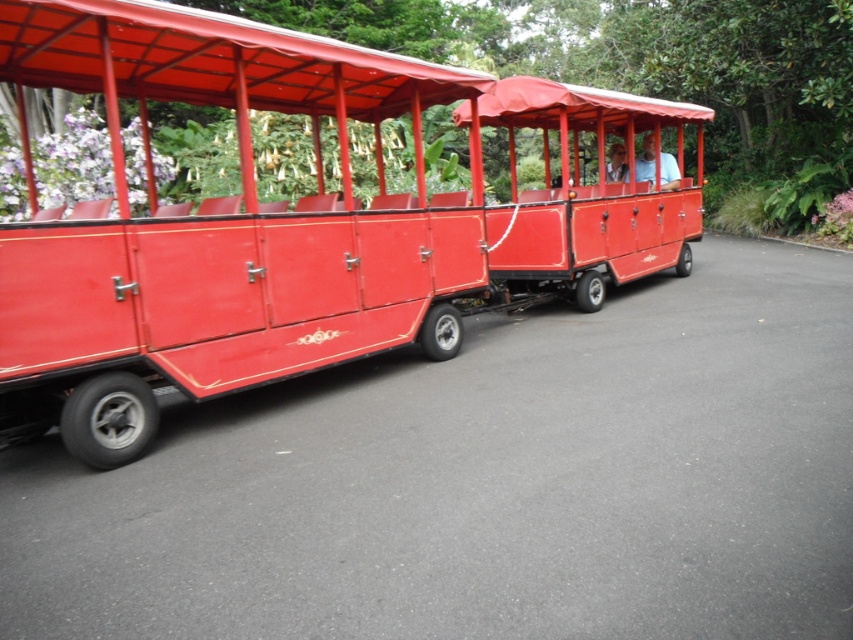
Is matte red train car at center to the right of matte red coach at center from the viewer's perspective?

No, matte red train car at center is not to the right of matte red coach at center.

Can you confirm if matte red train car at center is thinner than matte red coach at center?

Yes, matte red train car at center is thinner than matte red coach at center.

You are a GUI agent. You are given a task and a screenshot of the screen. Output one action in this format:
    pyautogui.click(x=<x>, y=<y>)
    Task: Click on the matte red train car at center
    This screenshot has height=640, width=853.
    Given the screenshot: What is the action you would take?
    pos(287,220)